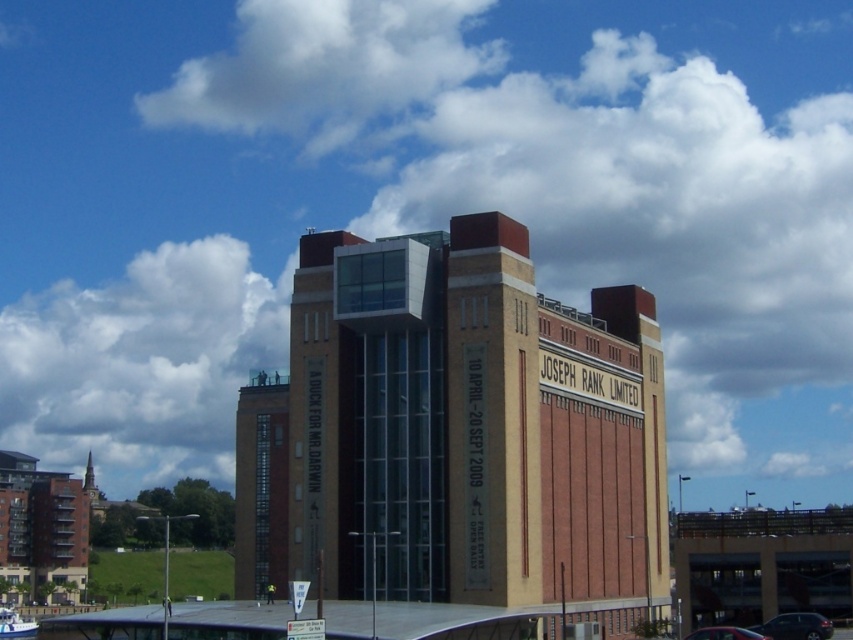
Question: From the image, what is the correct spatial relationship of white fluffy cloud at upper left in relation to shiny black car at lower right?

Choices:
 (A) above
 (B) below

Answer: (A)

Question: Does brown brick building at center have a larger size compared to white fluffy cloud at upper left?

Choices:
 (A) yes
 (B) no

Answer: (B)

Question: Which object is closer to the camera taking this photo?

Choices:
 (A) white fluffy cloud at upper left
 (B) metallic silver car at center
 (C) brown brick building at center
 (D) shiny black car at lower right

Answer: (B)

Question: Among these objects, which one is farthest from the camera?

Choices:
 (A) white fluffy cloud at upper left
 (B) brown brick building at center
 (C) shiny black car at lower right

Answer: (A)

Question: Observing the image, what is the correct spatial positioning of white fluffy cloud at upper center in reference to metallic silver car at center?

Choices:
 (A) right
 (B) left

Answer: (B)

Question: Which of the following is the closest to the observer?

Choices:
 (A) (337, 545)
 (B) (148, 410)
 (C) (734, 628)

Answer: (C)